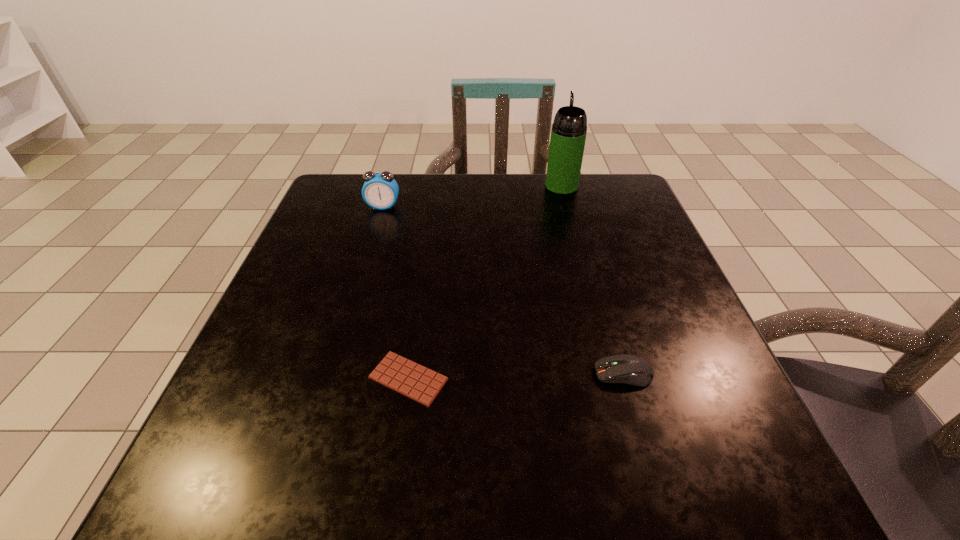
You are a GUI agent. You are given a task and a screenshot of the screen. Output one action in this format:
    pyautogui.click(x=<x>, y=<y>)
    Task: Click on the farthest object
    The width and height of the screenshot is (960, 540).
    Given the screenshot: What is the action you would take?
    pyautogui.click(x=568, y=135)

This screenshot has width=960, height=540. I want to click on the tallest object, so click(568, 135).

At what (x,y) coordinates should I click in order to perform the action: click on alarm clock. Please return your answer as a coordinate pair (x, y). The width and height of the screenshot is (960, 540). Looking at the image, I should click on (380, 190).

Find the location of a particular element. the leftmost object is located at coordinates tap(380, 190).

Identify the location of the third tallest object. (627, 369).

This screenshot has width=960, height=540. Identify the location of the third object from right to left. (417, 382).

I want to click on the shortest object, so click(x=417, y=382).

Locate an element on the screen. This screenshot has height=540, width=960. free space located on the face of the alarm clock is located at coordinates (350, 318).

Find the location of `vacant area located on the button of the third tallest object`. vacant area located on the button of the third tallest object is located at coordinates (508, 374).

You are a GUI agent. You are given a task and a screenshot of the screen. Output one action in this format:
    pyautogui.click(x=<x>, y=<y>)
    Task: Click on the vacant space located 0.390m on the button of the third tallest object
    The image size is (960, 540).
    Given the screenshot: What is the action you would take?
    pyautogui.click(x=354, y=374)